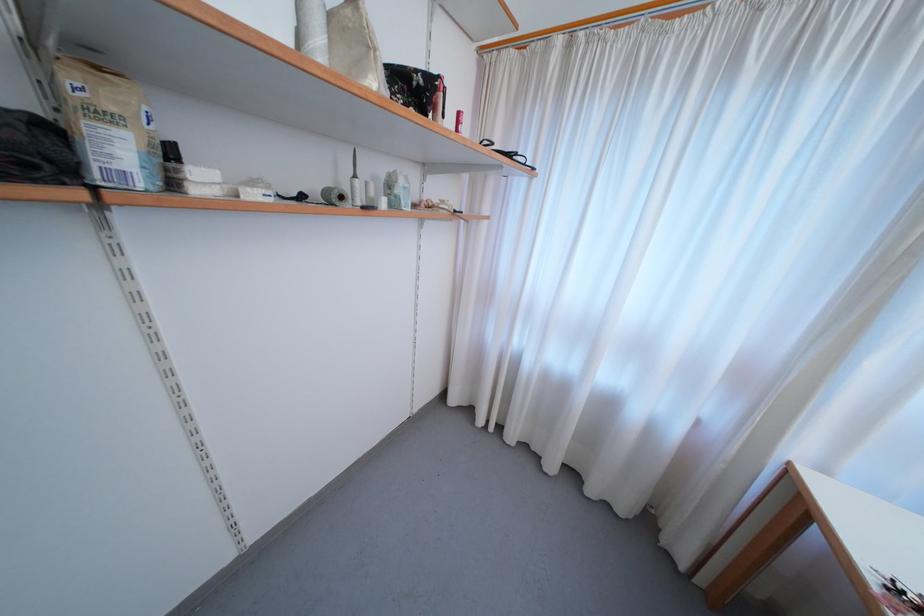
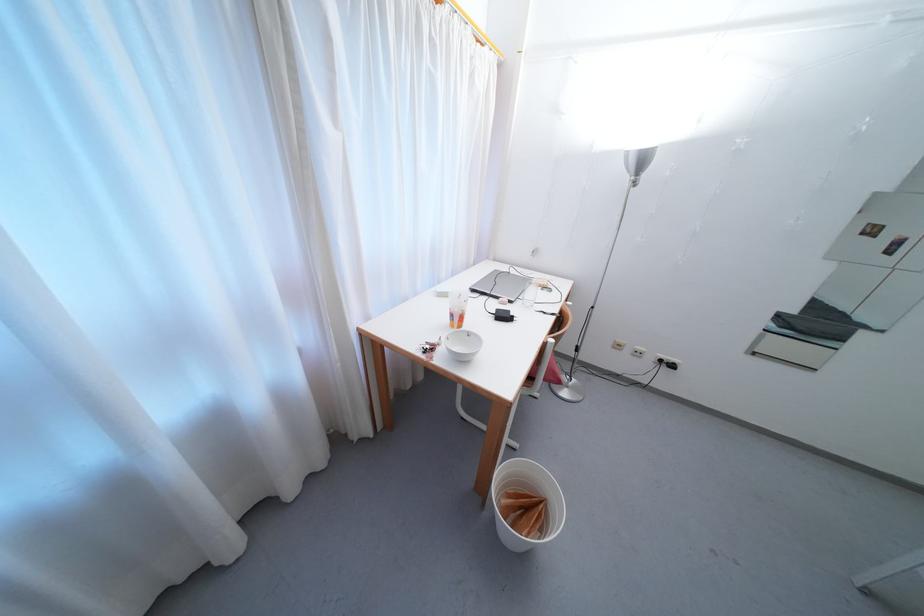
First-person continuous shooting, in which direction is the camera rotating?

The camera rotated toward right-down.